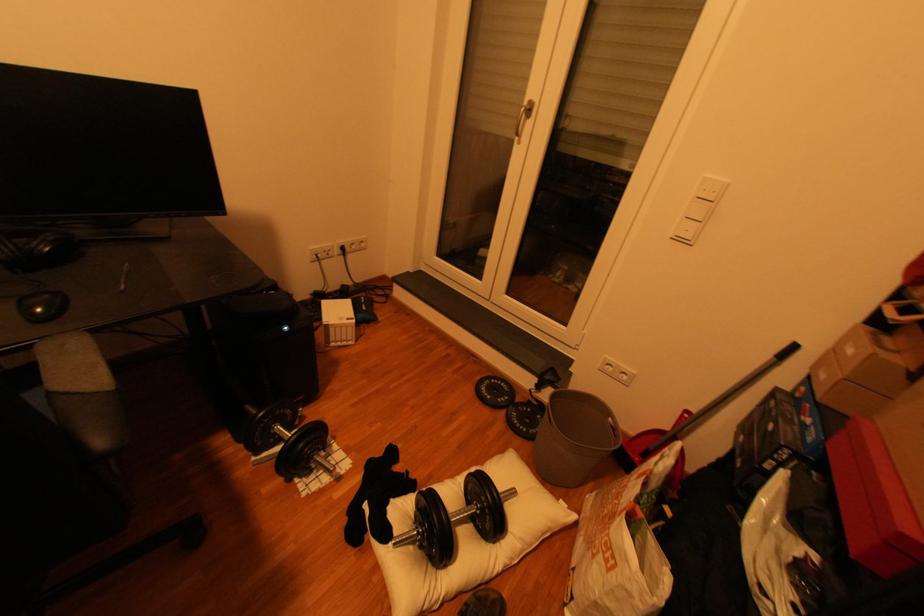
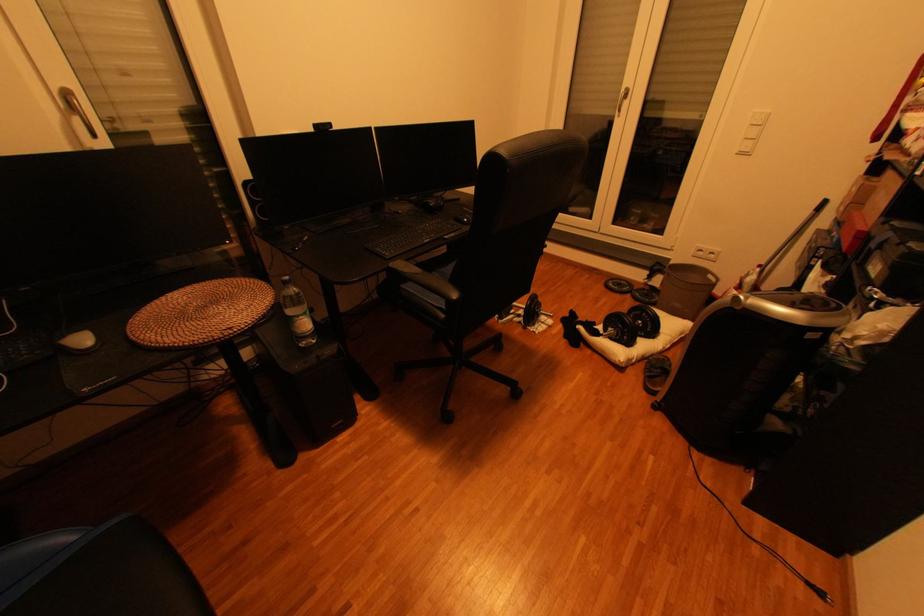
In the second image, find the point that corresponds to [687,240] in the first image.

(749, 155)